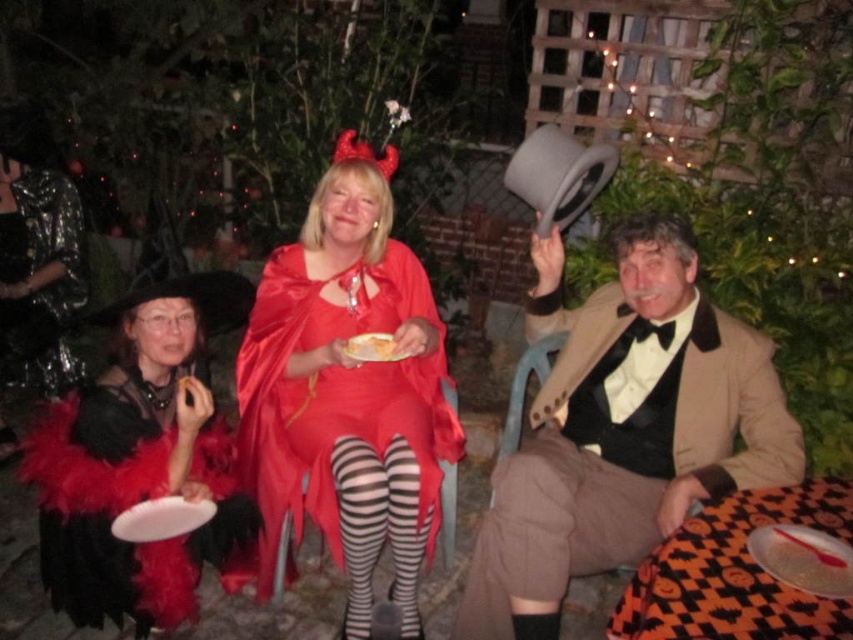
Find the location of a particular element. brown wool suit at right is located at coordinates (624, 429).

Between brown wool suit at right and shiny black cape at left, which one appears on the left side from the viewer's perspective?

From the viewer's perspective, shiny black cape at left appears more on the left side.

Is point (636, 442) farther from viewer compared to point (44, 196)?

No, it is not.

At what (x,y) coordinates should I click in order to perform the action: click on brown wool suit at right. Please return your answer as a coordinate pair (x, y). Looking at the image, I should click on (624, 429).

Is satin red dress at center closer to camera compared to matte silver platter at lower right?

No, it is not.

Who is lower down, satin red dress at center or matte silver platter at lower right?

matte silver platter at lower right is below.

Is point (389, 216) positioned in front of point (779, 548)?

No, it is behind (779, 548).

Find the location of a particular element. This screenshot has width=853, height=640. satin red dress at center is located at coordinates (347, 392).

In the scene shown: Can you confirm if satin red dress at center is positioned below white paper plate at center?

Actually, satin red dress at center is above white paper plate at center.

Between point (299, 384) and point (166, 500), which one is positioned behind?

Positioned behind is point (299, 384).

Does point (421, 448) come behind point (167, 500)?

Yes, point (421, 448) is farther from viewer.

Locate an element on the screen. The image size is (853, 640). satin red dress at center is located at coordinates (347, 392).